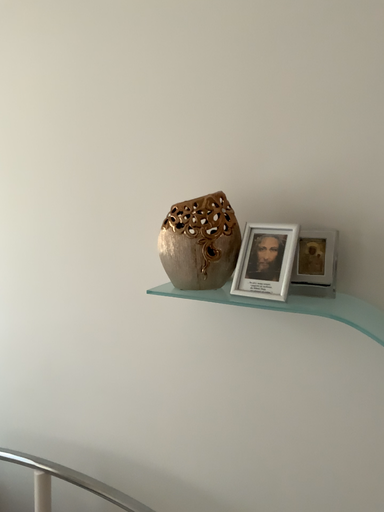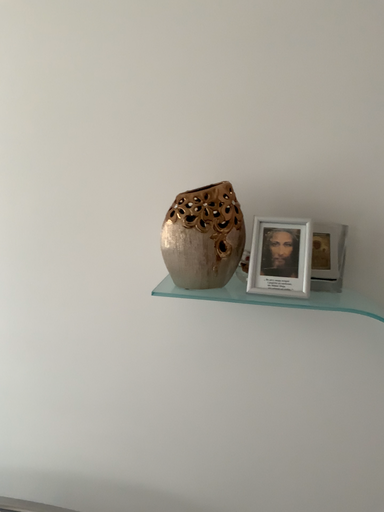
Question: How did the camera likely rotate when shooting the video?

Choices:
 (A) rotated left
 (B) rotated right

Answer: (B)